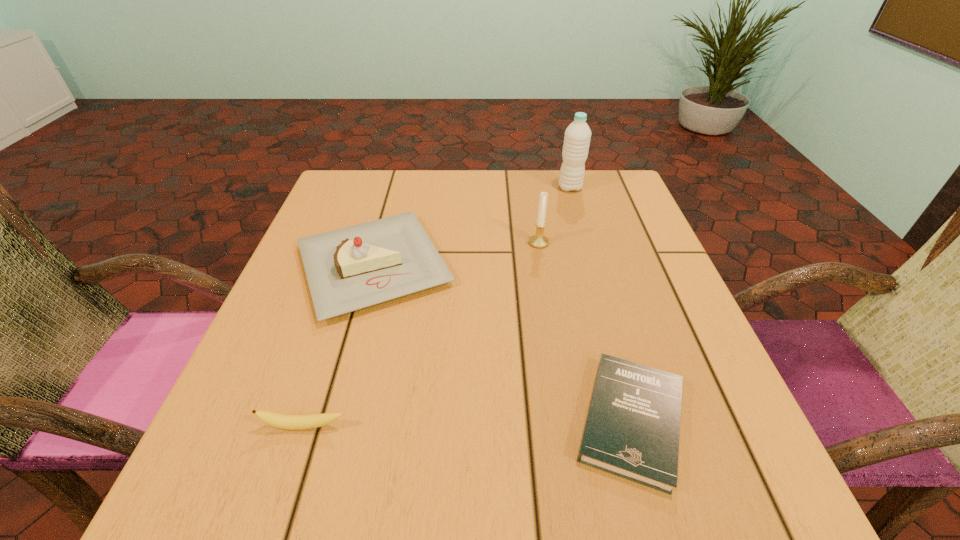
You are a GUI agent. You are given a task and a screenshot of the screen. Output one action in this format:
    pyautogui.click(x=<x>, y=<y>)
    Task: Click on the free space located 0.310m on the back of the shortest object
    This screenshot has height=540, width=960.
    Given the screenshot: What is the action you would take?
    pyautogui.click(x=583, y=246)

You are a GUI agent. You are given a task and a screenshot of the screen. Output one action in this format:
    pyautogui.click(x=<x>, y=<y>)
    Task: Click on the water bottle that is at the far edge
    Image resolution: width=960 pixels, height=540 pixels.
    Given the screenshot: What is the action you would take?
    pyautogui.click(x=577, y=137)

Locate an element on the screen. cake positioned at the far edge is located at coordinates (351, 268).

This screenshot has width=960, height=540. Find the location of `object at the near edge`. object at the near edge is located at coordinates (632, 429).

What are the coordinates of `cake situated at the left edge` in the screenshot? It's located at (351, 268).

You are a GUI agent. You are given a task and a screenshot of the screen. Output one action in this format:
    pyautogui.click(x=<x>, y=<y>)
    Task: Click on the banana at the left edge
    The width and height of the screenshot is (960, 540).
    Given the screenshot: What is the action you would take?
    pyautogui.click(x=290, y=422)

Identify the location of water bottle present at the right edge. The height and width of the screenshot is (540, 960). (577, 137).

Identify the location of book present at the right edge. (632, 429).

Locate an element on the screen. Image resolution: width=960 pixels, height=540 pixels. object located at the far left corner is located at coordinates (351, 268).

Find the location of a particular element. object situated at the far right corner is located at coordinates (577, 137).